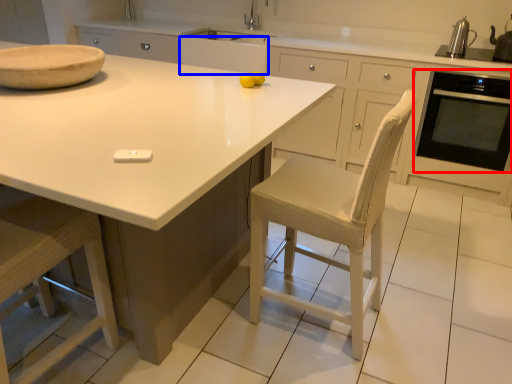
Question: Among these objects, which one is nearest to the camera, home appliance (highlighted by a red box) or cabinetry (highlighted by a blue box)?

Choices:
 (A) home appliance
 (B) cabinetry

Answer: (A)